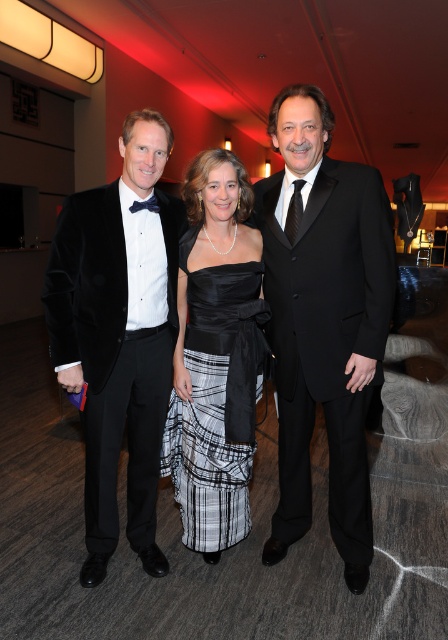
Which is behind, point (150, 557) or point (192, 525)?

Point (150, 557)

Does velvet black tuxedo at left have a lesser height compared to black satin dress at center?

In fact, velvet black tuxedo at left may be taller than black satin dress at center.

Describe the element at coordinates (119, 333) in the screenshot. I see `velvet black tuxedo at left` at that location.

You are a GUI agent. You are given a task and a screenshot of the screen. Output one action in this format:
    pyautogui.click(x=<x>, y=<y>)
    Task: Click on the velvet black tuxedo at left
    This screenshot has height=640, width=448.
    Given the screenshot: What is the action you would take?
    pyautogui.click(x=119, y=333)

Does velvet black tuxedo at center lie in front of velvet black tuxedo at left?

That is True.

Is point (330, 282) farther from camera compared to point (155, 129)?

Yes, it is.

The height and width of the screenshot is (640, 448). In order to click on velvet black tuxedo at center in this screenshot , I will do `click(323, 317)`.

Is velvet black tuxedo at center taller than black satin dress at center?

Correct, velvet black tuxedo at center is much taller as black satin dress at center.

The height and width of the screenshot is (640, 448). In order to click on velvet black tuxedo at center in this screenshot , I will do `click(323, 317)`.

At what (x,y) coordinates should I click in order to perform the action: click on velvet black tuxedo at center. Please return your answer as a coordinate pair (x, y). Looking at the image, I should click on (323, 317).